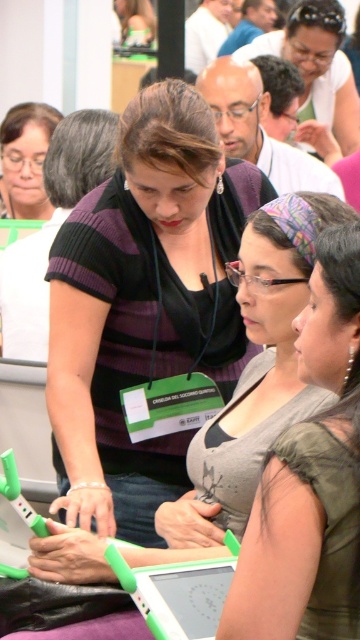
From the picture: You are a photographer trying to capture a closeup of the two points in the image. Which point, point (280, 472) or point (164, 580), is closer to your camera?

Point (280, 472) is closer to the camera than point (164, 580).

You are standing in the room and see the purple striped shirt at center and the matte black shirt at center. Which one is closer to you?

The purple striped shirt at center is closer to you because it is positioned over the matte black shirt at center.